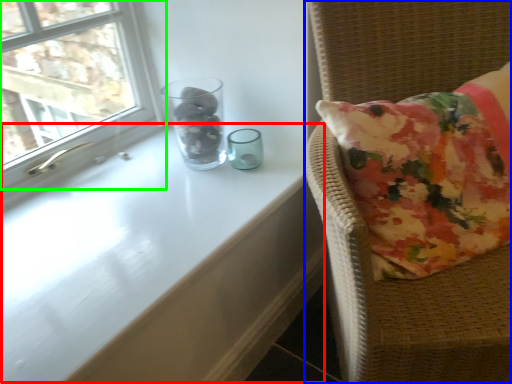
Question: Which object is positioned closest to table (highlighted by a red box)? Select from furniture (highlighted by a blue box) and window (highlighted by a green box).

Choices:
 (A) furniture
 (B) window

Answer: (A)